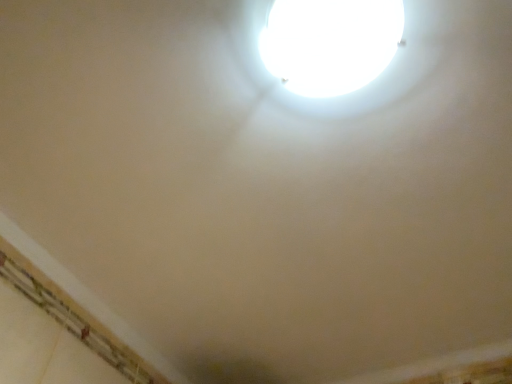
What is the approximate width of white glossy light fixture at upper center?

white glossy light fixture at upper center is 9.58 inches wide.

You are a GUI agent. You are given a task and a screenshot of the screen. Output one action in this format:
    pyautogui.click(x=<x>, y=<y>)
    Task: Click on the white glossy light fixture at upper center
    The width and height of the screenshot is (512, 384).
    Given the screenshot: What is the action you would take?
    pyautogui.click(x=330, y=43)

What do you see at coordinates (330, 43) in the screenshot? This screenshot has width=512, height=384. I see `white glossy light fixture at upper center` at bounding box center [330, 43].

I want to click on white glossy light fixture at upper center, so click(330, 43).